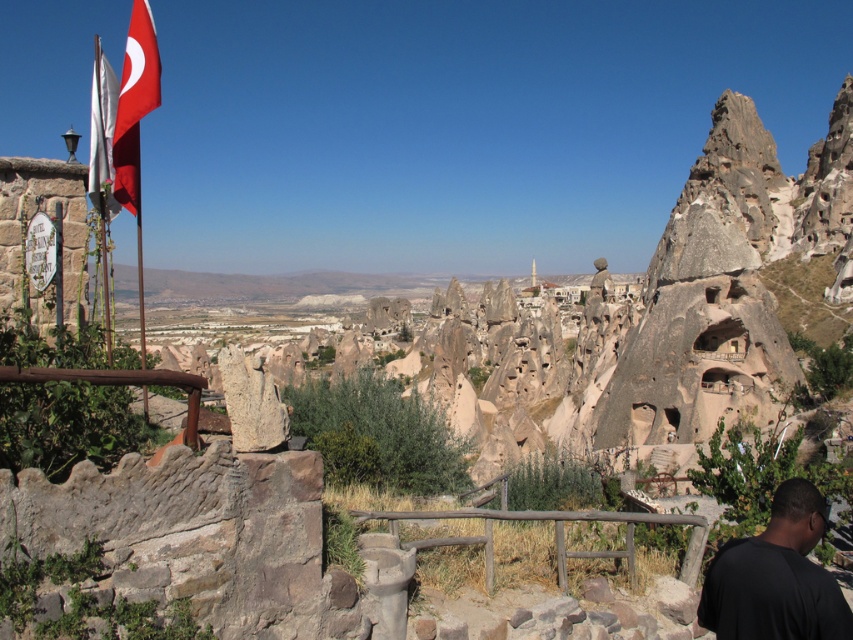
You are a tourist visiting this scenic viewpoint and want to take a photo of the landscape. You need to ensure the brown wooden rail at center and the red fabric flag at upper left are both in the frame. Which object should you position closer to the edge of your camera frame to avoid overcrowding the image?

Since the brown wooden rail at center is wider than the red fabric flag at upper left, you should position the brown wooden rail at center closer to the edge of your camera frame to prevent it from taking up too much space and overcrowding the image.

You are a tourist standing at the viewpoint and want to take a photo that includes both the brown wooden rail at center and the red fabric flag at upper left. Given that your camera has a maximum zoom range of 50 meters, will you be able to capture both objects in the same frame without moving closer?

The brown wooden rail at center and the red fabric flag at upper left are 43.95 meters apart. Since the distance between them is within the camera maximum zoom range of 50 meters, you can capture both objects in the same frame without moving closer.

You are standing at the viewpoint and want to take a photo of the white fabric flag at left without the brown wooden rail at center blocking the view. Is this possible?

The brown wooden rail at center is in front of the white fabric flag at left, so you cannot take a photo of the white fabric flag at left without the brown wooden rail at center blocking the view.